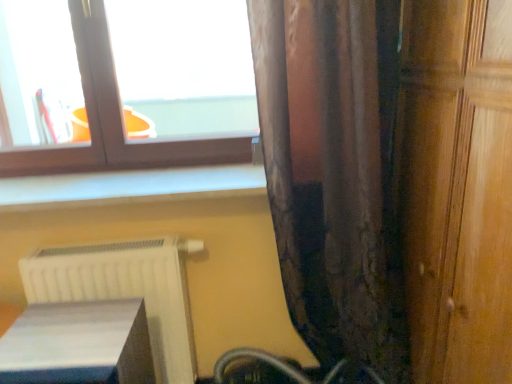
Question: From the image's perspective, is wooden door at right on white glossy book at lower left?

Choices:
 (A) no
 (B) yes

Answer: (B)

Question: Would you say wooden door at right is a long distance from white glossy book at lower left?

Choices:
 (A) no
 (B) yes

Answer: (A)

Question: From a real-world perspective, does wooden door at right stand above white glossy book at lower left?

Choices:
 (A) yes
 (B) no

Answer: (A)

Question: From the image's perspective, is wooden door at right beneath white glossy book at lower left?

Choices:
 (A) no
 (B) yes

Answer: (A)

Question: Considering the relative sizes of wooden door at right and white glossy book at lower left in the image provided, is wooden door at right bigger than white glossy book at lower left?

Choices:
 (A) yes
 (B) no

Answer: (A)

Question: Is brown textured curtain at right in front of or behind white glossy book at lower left in the image?

Choices:
 (A) front
 (B) behind

Answer: (B)

Question: Looking at their shapes, would you say brown textured curtain at right is wider or thinner than white glossy book at lower left?

Choices:
 (A) thin
 (B) wide

Answer: (B)

Question: From a real-world perspective, relative to white glossy book at lower left, is brown textured curtain at right vertically above or below?

Choices:
 (A) above
 (B) below

Answer: (A)

Question: Is brown textured curtain at right to the left or to the right of white glossy book at lower left in the image?

Choices:
 (A) left
 (B) right

Answer: (B)

Question: Considering their positions, is wooden door at right located in front of or behind brown textured curtain at right?

Choices:
 (A) behind
 (B) front

Answer: (B)

Question: Considering the positions of point coord(475,76) and point coord(328,1), is point coord(475,76) closer or farther from the camera than point coord(328,1)?

Choices:
 (A) farther
 (B) closer

Answer: (B)

Question: From the image's perspective, is wooden door at right positioned above or below brown textured curtain at right?

Choices:
 (A) above
 (B) below

Answer: (B)

Question: Considering the positions of wooden door at right and brown textured curtain at right in the image, is wooden door at right wider or thinner than brown textured curtain at right?

Choices:
 (A) wide
 (B) thin

Answer: (A)

Question: Is white glossy book at lower left situated inside matte brown window at upper left or outside?

Choices:
 (A) outside
 (B) inside

Answer: (A)

Question: Is white glossy book at lower left to the left or to the right of matte brown window at upper left in the image?

Choices:
 (A) left
 (B) right

Answer: (B)